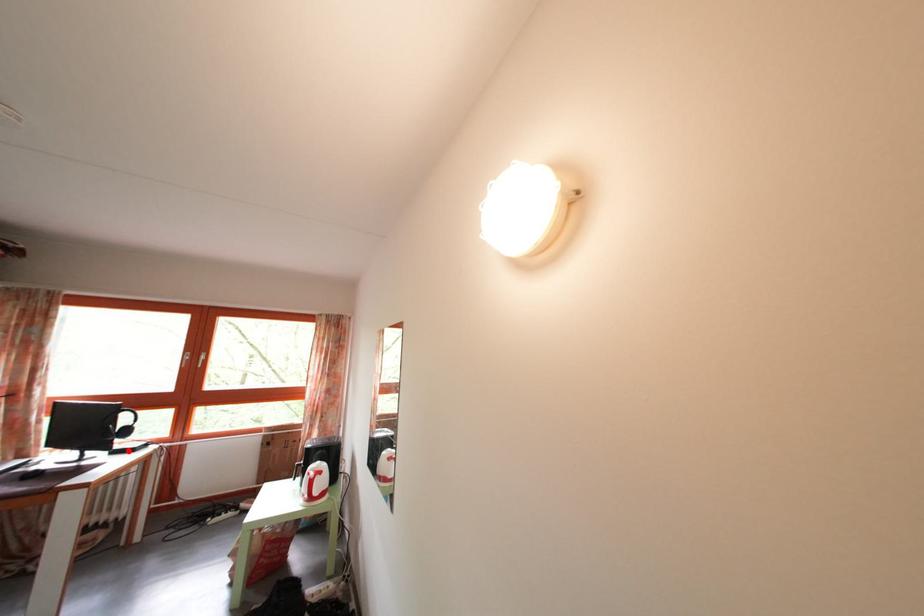
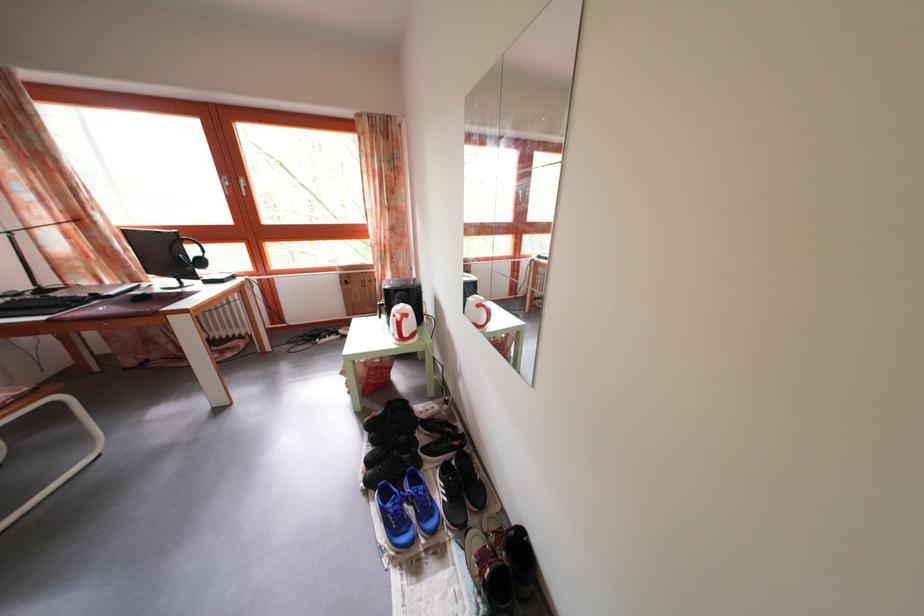
In the second image, find the point that corresponds to the highlighted location in the first image.

(213, 281)